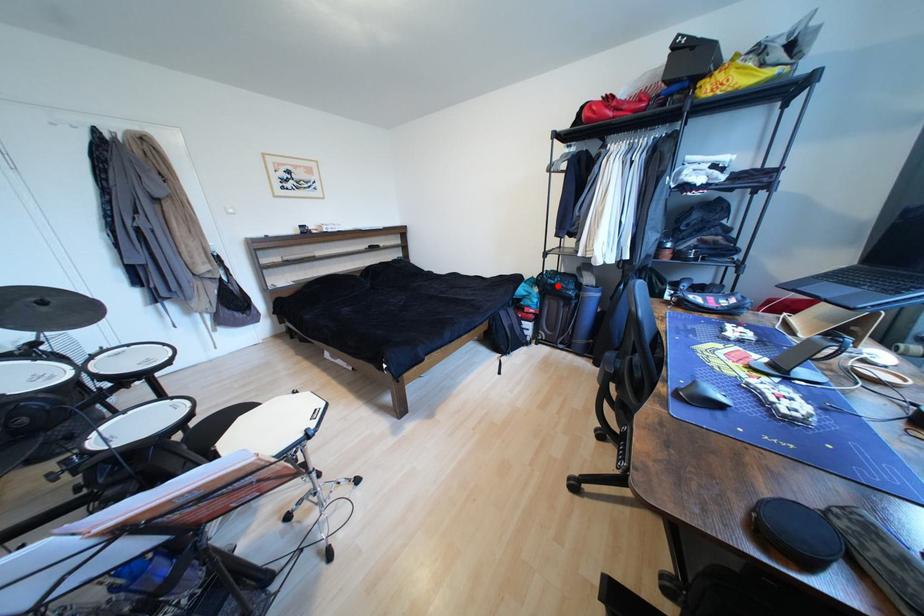
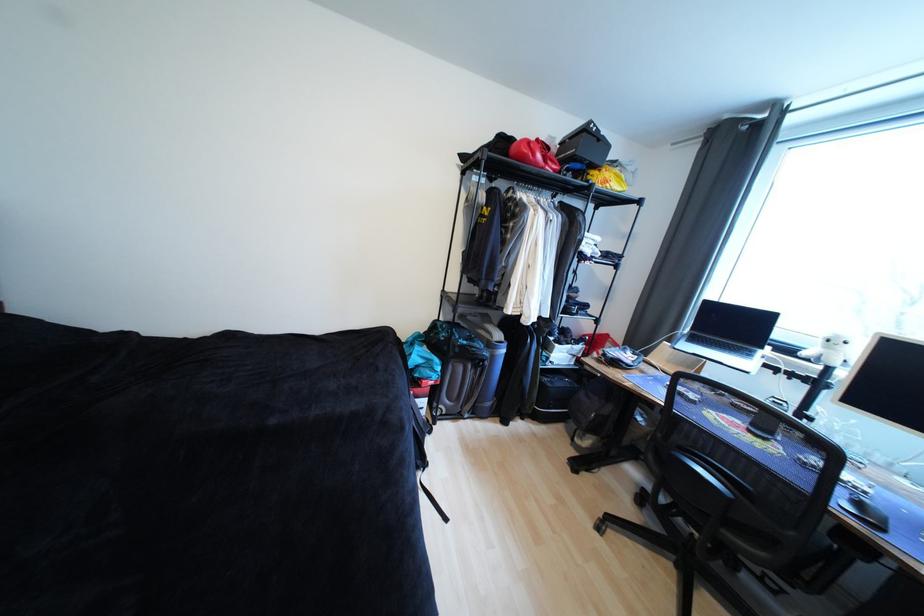
Question: I am providing you with two images of the same scene from different viewpoints. A red point is shown in image1. For the corresponding object point in image2, is it positioned nearer or farther from the camera?

Choices:
 (A) Nearer
 (B) Farther

Answer: (B)